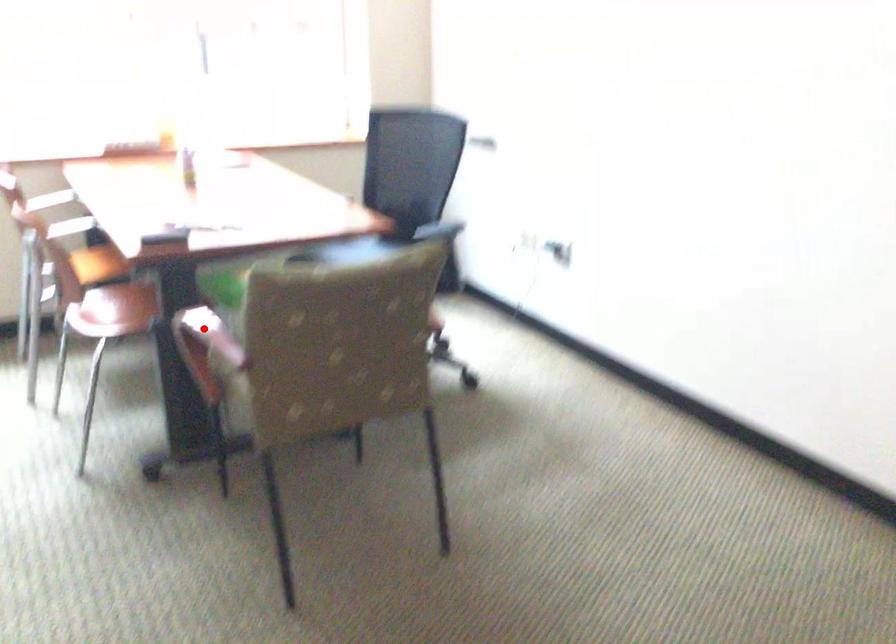
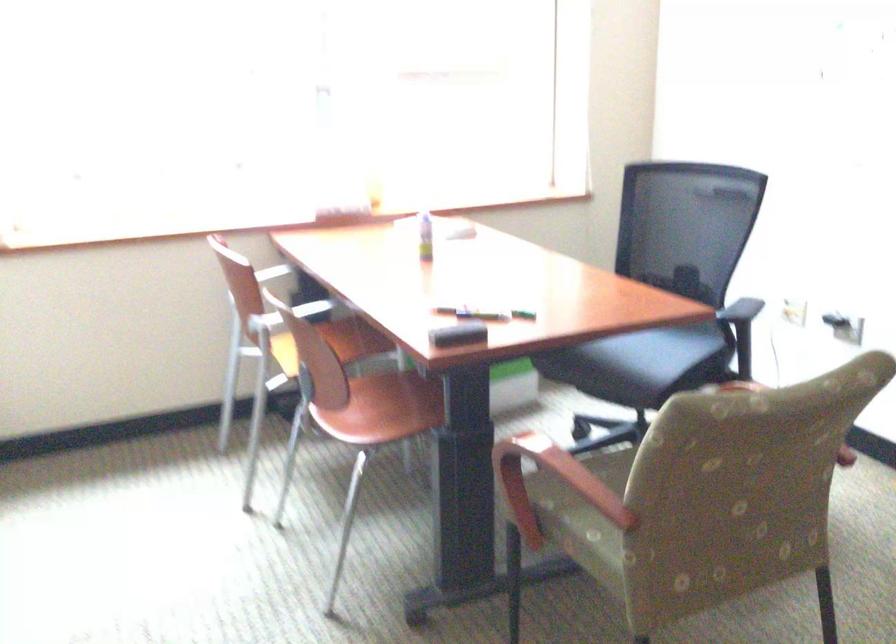
The point at the highlighted location is marked in the first image. Where is the corresponding point in the second image?

(561, 475)